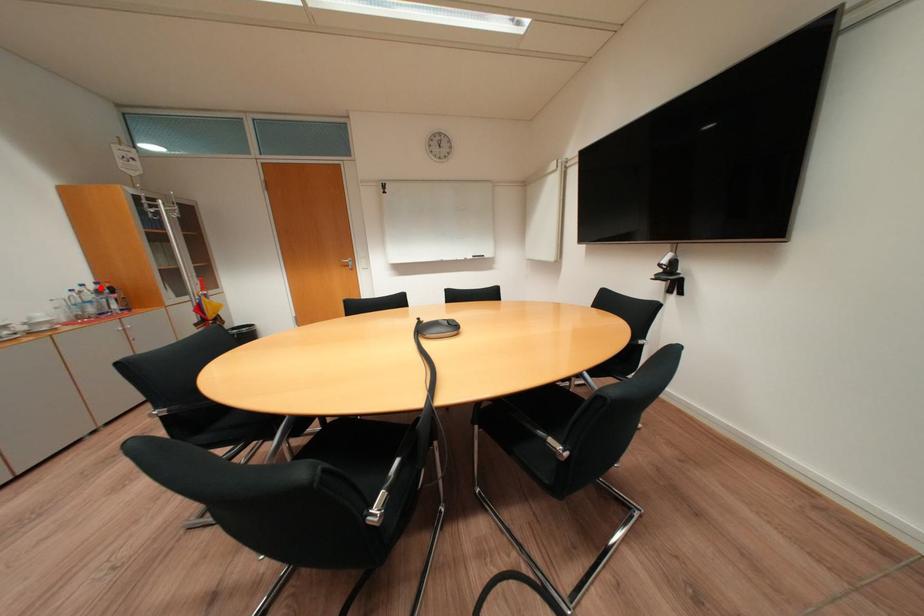
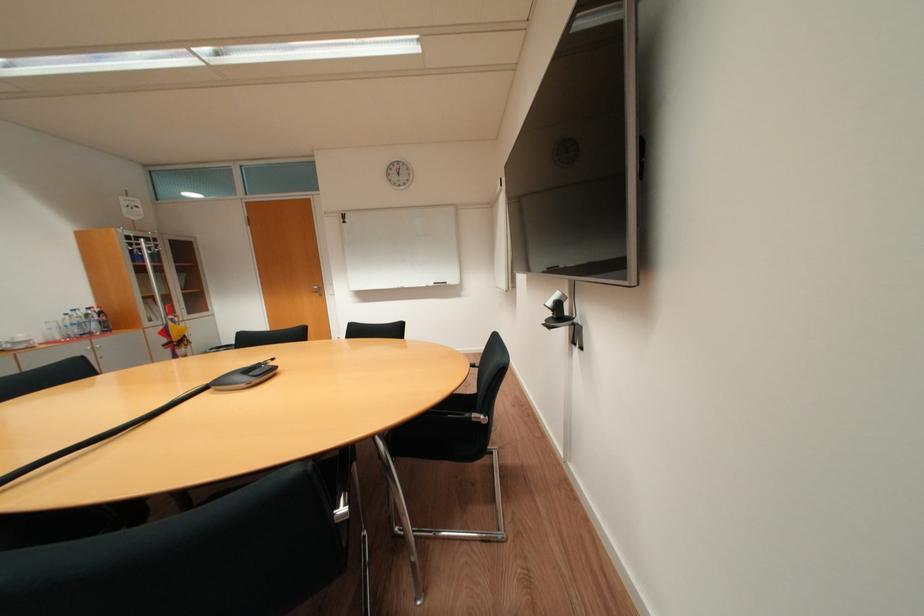
Find the pixel in the second image that matches the highlighted location in the first image.

(92, 313)